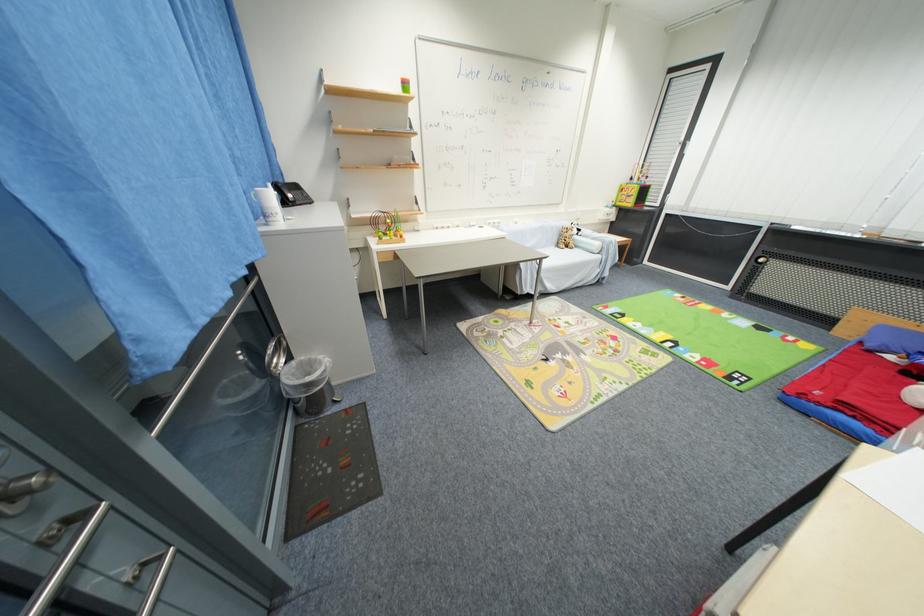
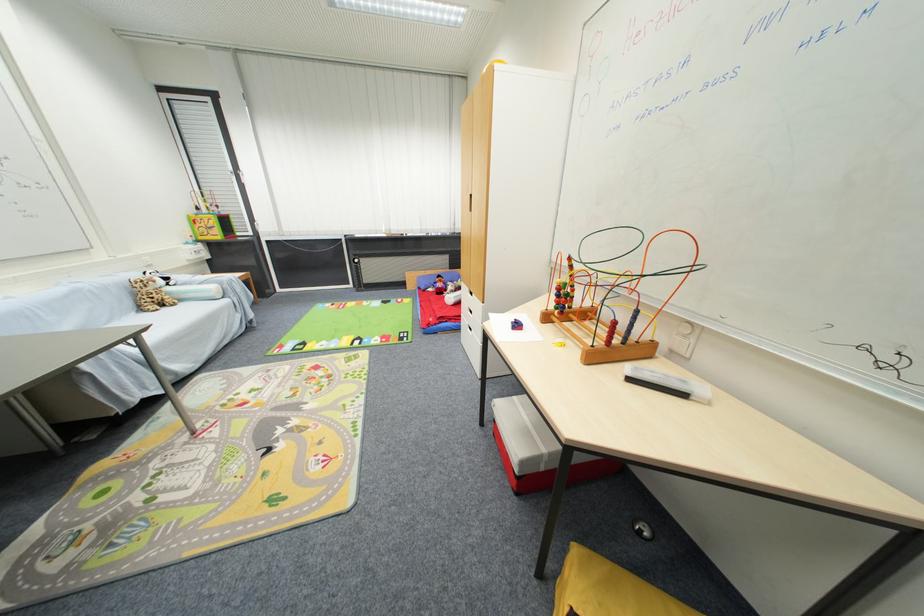
Where in the second image is the point corresponding to (x=602, y=246) from the first image?

(217, 290)